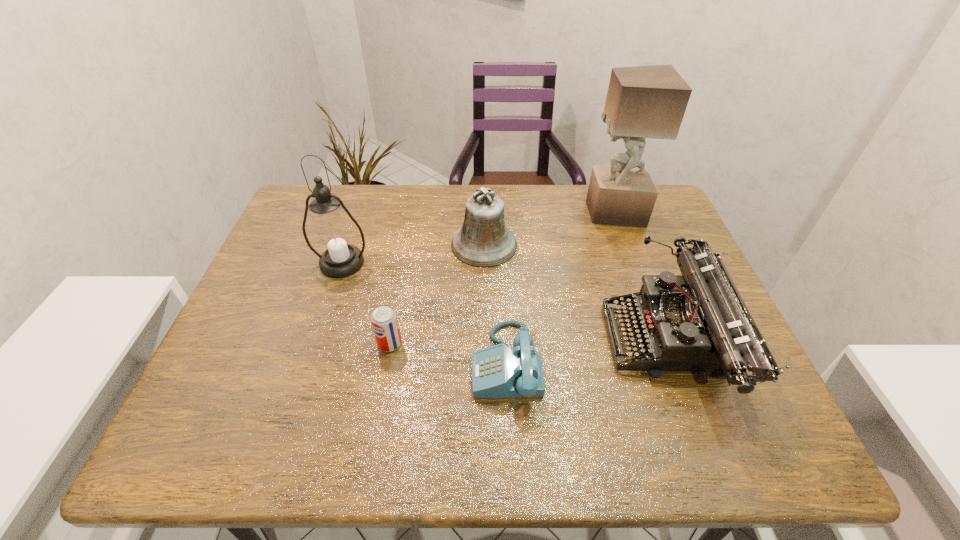
Where is `the tallest object`? This screenshot has width=960, height=540. the tallest object is located at coordinates (642, 102).

The image size is (960, 540). Identify the location of oil lamp. (333, 235).

Find the location of a particular element. This screenshot has width=960, height=540. the fifth shortest object is located at coordinates (333, 235).

Identify the location of bell. This screenshot has height=540, width=960. (483, 241).

The width and height of the screenshot is (960, 540). Find the location of `typewriter`. typewriter is located at coordinates (697, 321).

Locate an element on the screen. soda is located at coordinates (384, 320).

Find the location of a particular element. This screenshot has height=540, width=960. the fifth tallest object is located at coordinates (384, 320).

The height and width of the screenshot is (540, 960). Find the location of `the shortest object`. the shortest object is located at coordinates (497, 372).

Where is `free space located 0.120m on the front-facing side of the tallest object`? free space located 0.120m on the front-facing side of the tallest object is located at coordinates (547, 212).

The width and height of the screenshot is (960, 540). Identify the location of vacant area situated on the front-facing side of the tallest object. (515, 212).